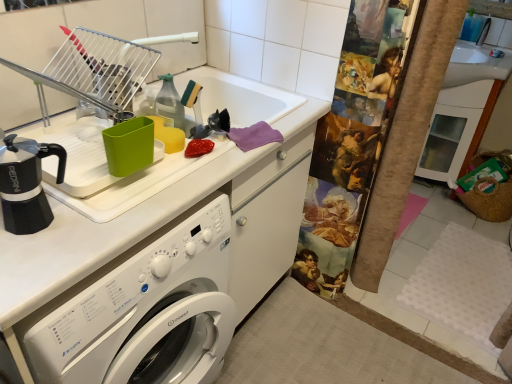
Question: Is metallic silver dish rack at upper left facing towards white glossy washing machine at center?

Choices:
 (A) no
 (B) yes

Answer: (A)

Question: From the image's perspective, is metallic silver dish rack at upper left located beneath white glossy washing machine at center?

Choices:
 (A) no
 (B) yes

Answer: (A)

Question: Is metallic silver dish rack at upper left shorter than white glossy washing machine at center?

Choices:
 (A) no
 (B) yes

Answer: (B)

Question: Can you confirm if metallic silver dish rack at upper left is thinner than white glossy washing machine at center?

Choices:
 (A) yes
 (B) no

Answer: (A)

Question: From a real-world perspective, is metallic silver dish rack at upper left under white glossy washing machine at center?

Choices:
 (A) no
 (B) yes

Answer: (A)

Question: Is metallic silver dish rack at upper left positioned in front of white glossy washing machine at center?

Choices:
 (A) no
 (B) yes

Answer: (A)

Question: Does brushed metal faucet at upper center appear on the left side of metallic silver dish rack at upper left?

Choices:
 (A) no
 (B) yes

Answer: (A)

Question: Can you confirm if brushed metal faucet at upper center is smaller than metallic silver dish rack at upper left?

Choices:
 (A) yes
 (B) no

Answer: (A)

Question: Is brushed metal faucet at upper center further to camera compared to metallic silver dish rack at upper left?

Choices:
 (A) no
 (B) yes

Answer: (B)

Question: From a real-world perspective, does brushed metal faucet at upper center sit lower than metallic silver dish rack at upper left?

Choices:
 (A) yes
 (B) no

Answer: (B)

Question: Is brushed metal faucet at upper center shorter than metallic silver dish rack at upper left?

Choices:
 (A) yes
 (B) no

Answer: (A)

Question: Is brushed metal faucet at upper center directly adjacent to metallic silver dish rack at upper left?

Choices:
 (A) no
 (B) yes

Answer: (A)

Question: Is black matte coffee pot at left located within brushed metal faucet at upper center?

Choices:
 (A) no
 (B) yes

Answer: (A)